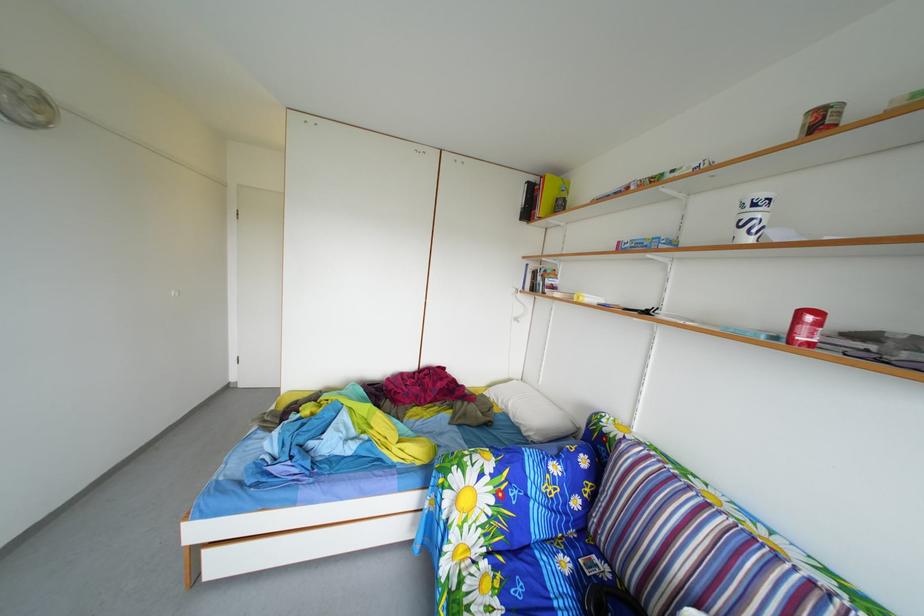
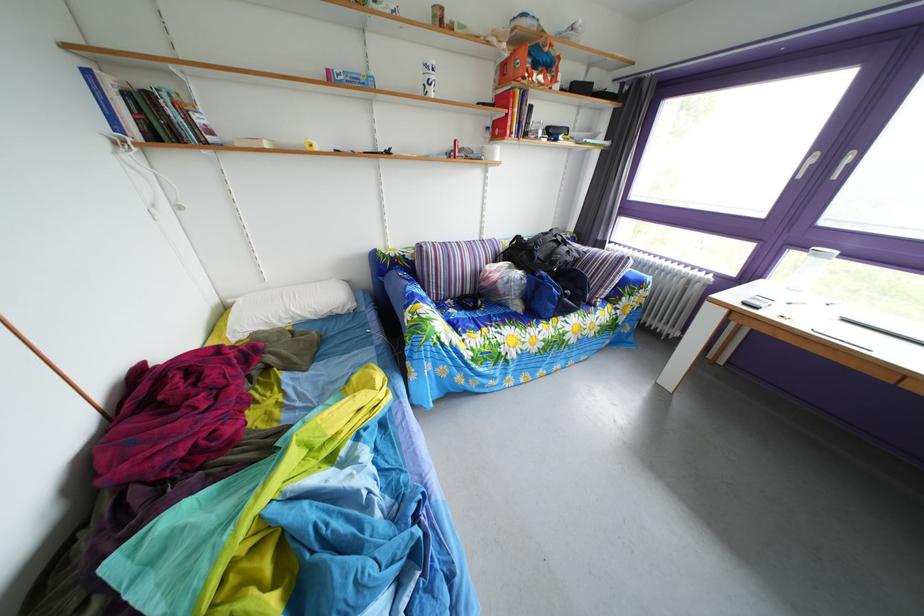
Where in the second image is the point corresponding to (x=576, y=570) from the first image?

(463, 320)